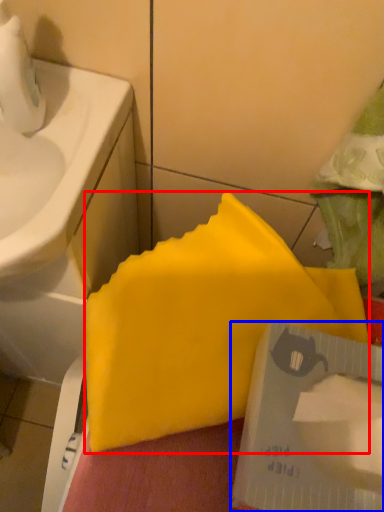
Question: Which point is closer to the camera, waste (highlighted by a red box) or writing (highlighted by a blue box)?

Choices:
 (A) waste
 (B) writing

Answer: (B)